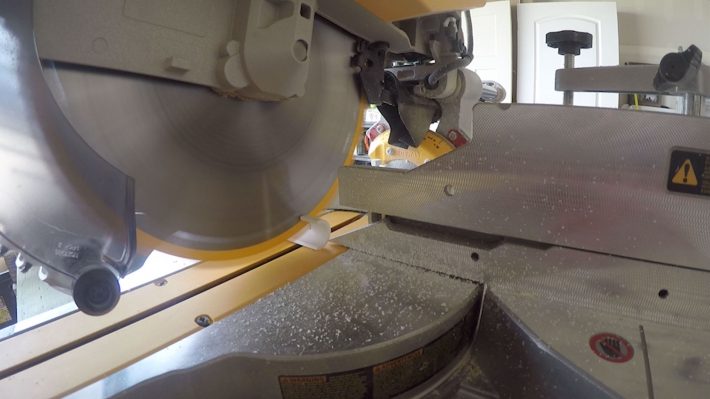
Find the location of `tan wood`. tan wood is located at coordinates (160, 319), (148, 296).